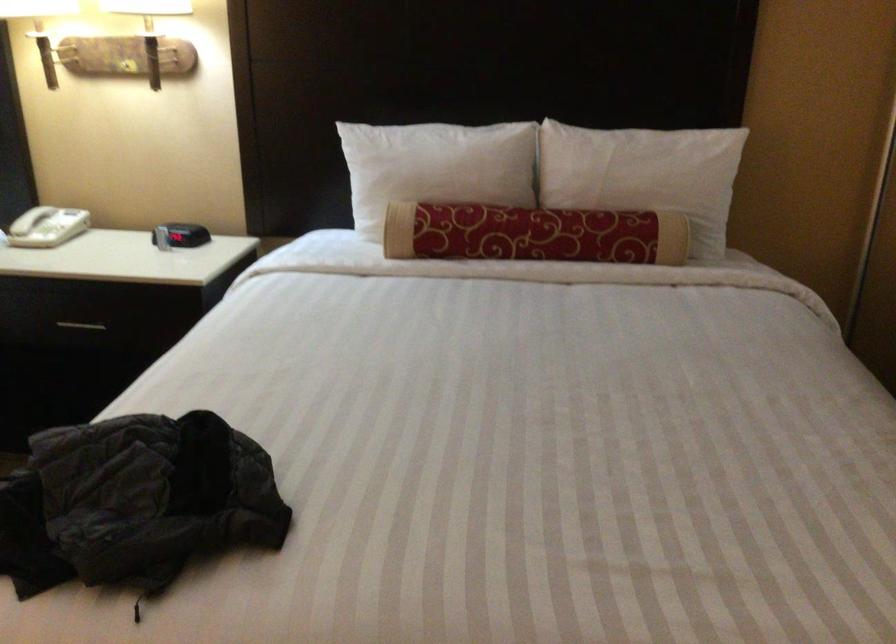
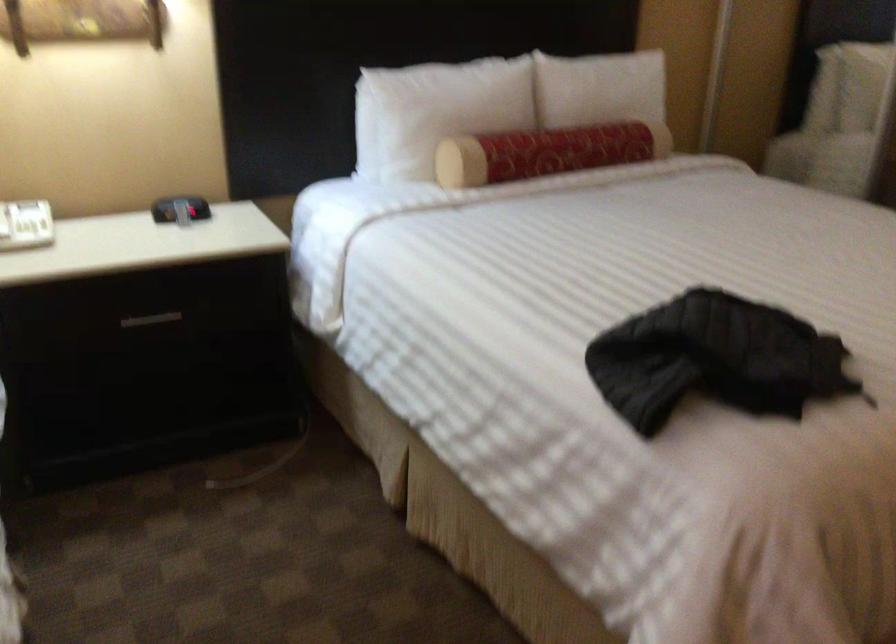
Find the pixel in the second image that matches (388,173) in the first image.

(435, 111)